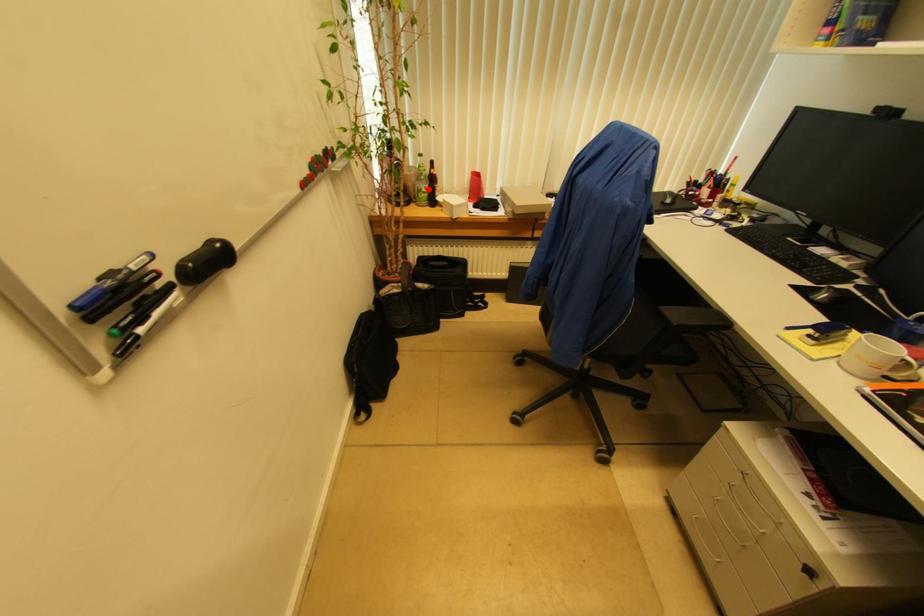
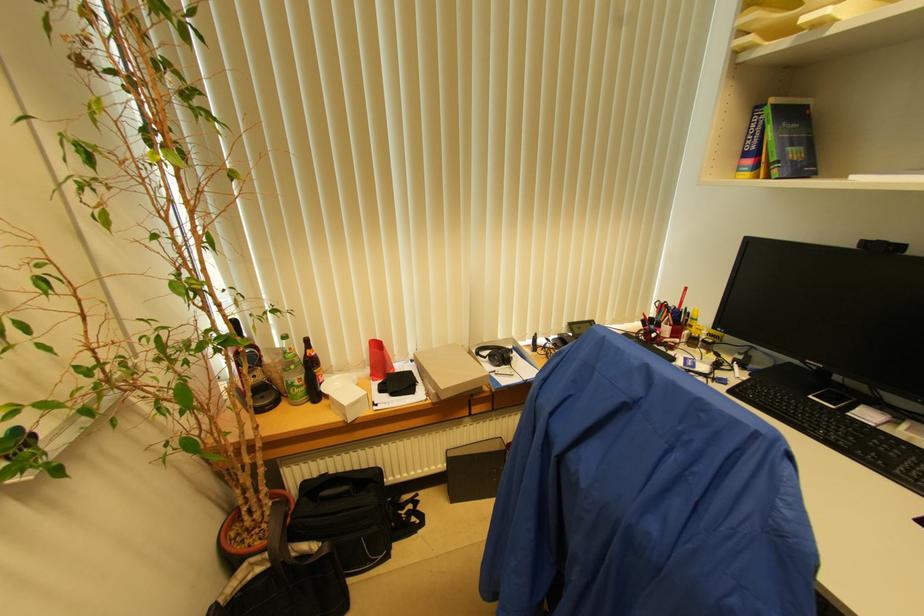
Find the pixel in the second image that matches the highlighted location in the first image.

(304, 379)